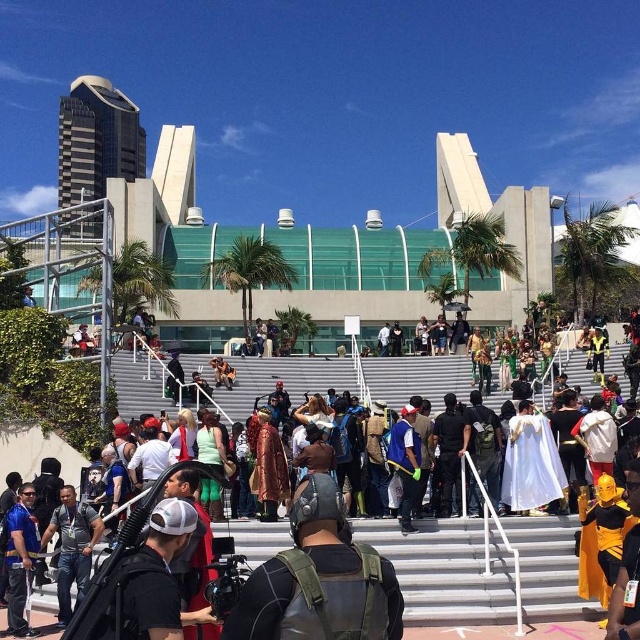
Question: Does white cotton shirt at center have a lesser width compared to matte black helmet at center?

Choices:
 (A) yes
 (B) no

Answer: (B)

Question: Is white cotton shirt at center to the right of matte black helmet at center from the viewer's perspective?

Choices:
 (A) yes
 (B) no

Answer: (A)

Question: Does white cotton shirt at center have a larger size compared to matte black helmet at center?

Choices:
 (A) yes
 (B) no

Answer: (A)

Question: Which point is closer to the camera?

Choices:
 (A) (339, 566)
 (B) (449, 561)

Answer: (A)

Question: Which point is farther to the camera?

Choices:
 (A) matte black helmet at center
 (B) white cotton shirt at center

Answer: (B)